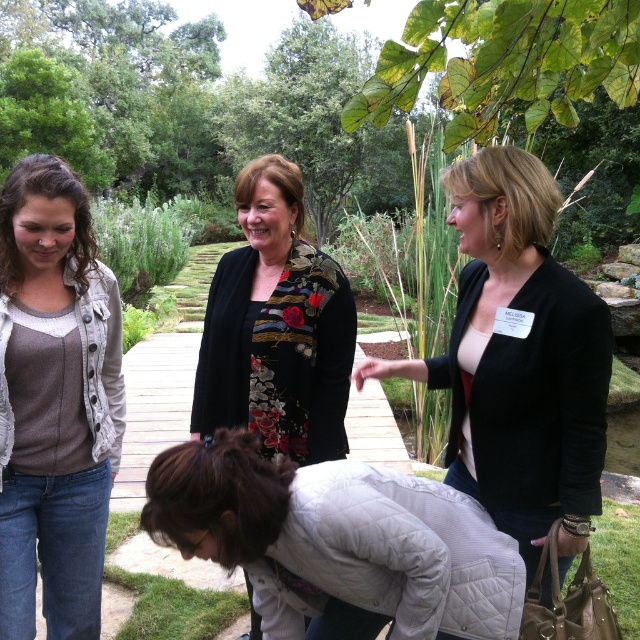
Between point (8, 376) and point (212, 298), which one is positioned behind?

The point (212, 298) is behind.

Does point (16, 420) lie in front of point (296, 250)?

That is True.

At what (x,y) coordinates should I click in order to perform the action: click on matte gray sweater at left. Please return your answer as a coordinate pair (x, y). Looking at the image, I should click on (54, 401).

Does black matte blazer at upper right come behind matte gray sweater at left?

No, black matte blazer at upper right is in front of matte gray sweater at left.

Can you confirm if black matte blazer at upper right is wider than matte gray sweater at left?

Yes, black matte blazer at upper right is wider than matte gray sweater at left.

Which is behind, point (506, 499) or point (49, 385)?

The point (49, 385) is behind.

Image resolution: width=640 pixels, height=640 pixels. I want to click on black matte blazer at upper right, so click(x=518, y=360).

Is black matte blazer at upper right positioned behind floral-patterned fabric at center?

No, it is in front of floral-patterned fabric at center.

Can you confirm if black matte blazer at upper right is positioned to the left of floral-patterned fabric at center?

In fact, black matte blazer at upper right is to the right of floral-patterned fabric at center.

Is point (516, 424) closer to viewer compared to point (220, 291)?

Yes, it is in front of point (220, 291).

Find the location of `black matte blazer at upper right`. black matte blazer at upper right is located at coordinates (518, 360).